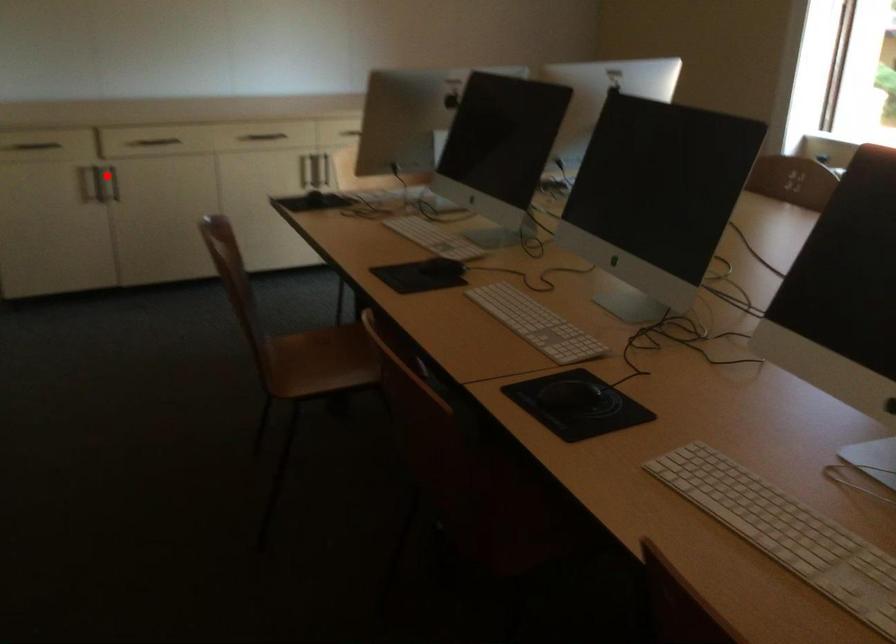
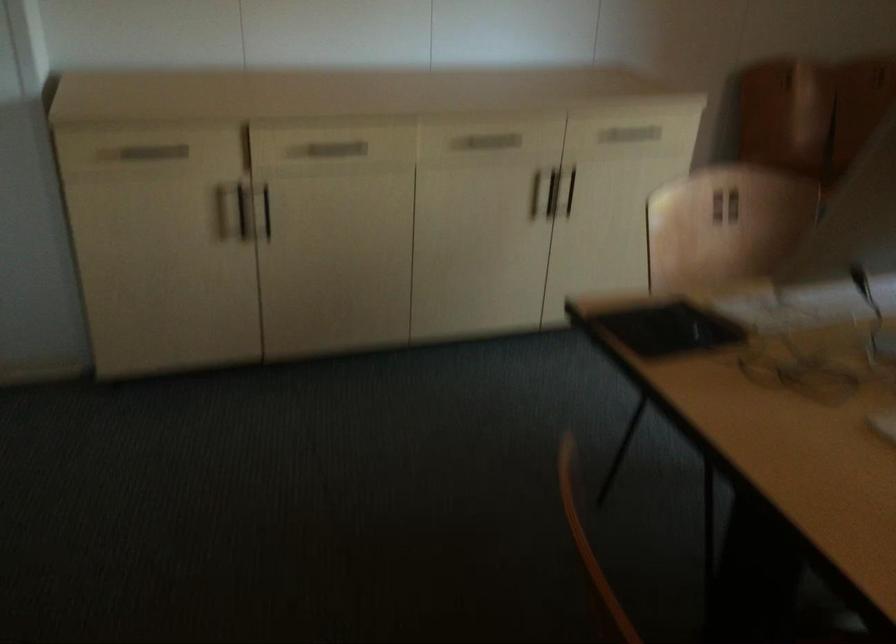
Locate, in the second image, the point that corresponds to the highlighted location in the first image.

(264, 211)